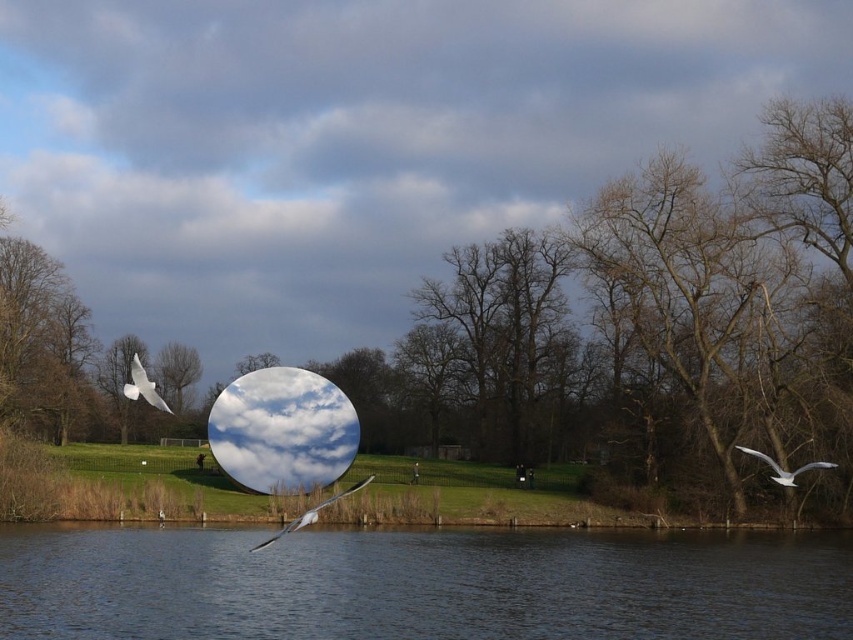
Question: Is transparent glass sphere at center further to the viewer compared to white feathered bird at lower center?

Choices:
 (A) yes
 (B) no

Answer: (A)

Question: Which point is farther to the camera?

Choices:
 (A) (751, 449)
 (B) (305, 125)
 (C) (593, 632)
 (D) (137, 371)

Answer: (B)

Question: Which is nearer to the white feathered bird at right?

Choices:
 (A) white feathered bird at lower center
 (B) white feathered bird at upper left
 (C) transparent glass water at lower center
 (D) transparent glass sphere at center

Answer: (C)

Question: Where is transparent glass water at lower center located in relation to white feathered bird at right in the image?

Choices:
 (A) above
 (B) below

Answer: (B)

Question: Which object is the farthest from the white feathered bird at lower center?

Choices:
 (A) white feathered bird at right
 (B) transparent glass water at lower center
 (C) brown matte tree at center

Answer: (C)

Question: Can you confirm if transparent glass sphere at center is smaller than white feathered bird at lower center?

Choices:
 (A) no
 (B) yes

Answer: (A)